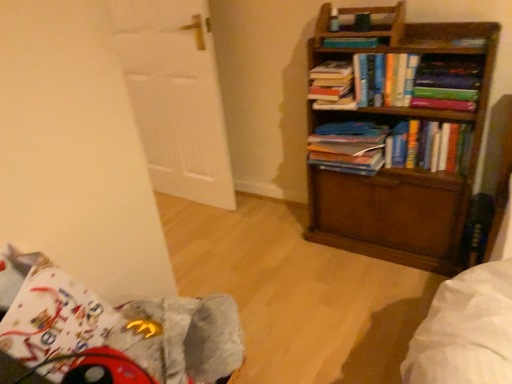
What do you see at coordinates (330, 80) in the screenshot?
I see `hardcover book at upper center, which is the 2th book in top-to-bottom order` at bounding box center [330, 80].

Locate an element on the screen. The width and height of the screenshot is (512, 384). white wooden door at left is located at coordinates (175, 96).

Find the location of a particular element. hardcover book at upper center, the 1th book positioned from the top is located at coordinates (350, 42).

What do you see at coordinates (348, 147) in the screenshot?
I see `blue matte book at center, which is the second book in bottom-to-top order` at bounding box center [348, 147].

Identify the location of hardcover books at upper center, acting as the third book starting from the bottom. (384, 79).

Which object is positioned more to the right, hardcover books at center, arranged as the 5th book when viewed from the top, or hardcover book at upper center, the fifth book positioned from the bottom?

hardcover books at center, arranged as the 5th book when viewed from the top.

Is hardcover books at center, the 1th book from the bottom, oriented away from hardcover book at upper center, the 1th book positioned from the top?

No, hardcover books at center, the 1th book from the bottom, is not facing away from hardcover book at upper center, the 1th book positioned from the top.

Does hardcover books at center, the 1th book from the bottom, have a larger size compared to hardcover book at upper center, the fifth book positioned from the bottom?

Yes, hardcover books at center, the 1th book from the bottom, is bigger than hardcover book at upper center, the fifth book positioned from the bottom.

Is hardcover books at upper center, the 3th book positioned from the top, oriented towards hardcover books at center, the 1th book from the bottom?

No.

Is hardcover books at upper center, acting as the third book starting from the bottom, at the right side of hardcover books at center, the 1th book from the bottom?

No, hardcover books at upper center, acting as the third book starting from the bottom, is not to the right of hardcover books at center, the 1th book from the bottom.

In the scene shown: Does hardcover books at upper center, the 3th book positioned from the top, have a smaller size compared to hardcover books at center, arranged as the 5th book when viewed from the top?

Indeed, hardcover books at upper center, the 3th book positioned from the top, has a smaller size compared to hardcover books at center, arranged as the 5th book when viewed from the top.

Consider the image. Can you confirm if hardcover books at upper center, the 3th book positioned from the top, is taller than hardcover books at center, the 1th book from the bottom?

Incorrect, the height of hardcover books at upper center, the 3th book positioned from the top, is not larger of that of hardcover books at center, the 1th book from the bottom.

Considering the sizes of objects white wooden door at left and fuzzy fabric swivel chair at lower left in the image provided, who is taller, white wooden door at left or fuzzy fabric swivel chair at lower left?

white wooden door at left is taller.

Is point (165, 95) behind point (132, 376)?

Yes, point (165, 95) is farther from viewer.

From a real-world perspective, which object stands above the other?

white wooden door at left.

Is the surface of white wooden door at left in direct contact with fuzzy fabric swivel chair at lower left?

No, white wooden door at left is not beside fuzzy fabric swivel chair at lower left.

Consider the image. Which point is more forward, (126,378) or (366,140)?

The point (126,378) is closer to the camera.

Considering the positions of objects fuzzy fabric swivel chair at lower left and blue matte book at center, the 4th book viewed from the top, in the image provided, who is behind, fuzzy fabric swivel chair at lower left or blue matte book at center, the 4th book viewed from the top,?

blue matte book at center, the 4th book viewed from the top, is more distant.

Is blue matte book at center, the 4th book viewed from the top, surrounded by fuzzy fabric swivel chair at lower left?

No.

Who is smaller, fuzzy fabric swivel chair at lower left or blue matte book at center, the 4th book viewed from the top?

blue matte book at center, the 4th book viewed from the top, is smaller.

Considering the positions of objects hardcover books at center, arranged as the 5th book when viewed from the top, and wooden bookcase at right in the image provided, who is behind, hardcover books at center, arranged as the 5th book when viewed from the top, or wooden bookcase at right?

hardcover books at center, arranged as the 5th book when viewed from the top, is further from the camera.

Does point (444, 126) come closer to viewer compared to point (330, 177)?

That is True.

Does hardcover books at center, arranged as the 5th book when viewed from the top, have a greater width compared to wooden bookcase at right?

Incorrect, the width of hardcover books at center, arranged as the 5th book when viewed from the top, does not surpass that of wooden bookcase at right.

How different are the orientations of hardcover books at center, the 1th book from the bottom, and white wooden door at left in degrees?

There is a 1.13-degree angle between the facing directions of hardcover books at center, the 1th book from the bottom, and white wooden door at left.

Is the surface of hardcover books at center, the 1th book from the bottom, in direct contact with white wooden door at left?

They are not placed beside each other.

Is hardcover books at center, the 1th book from the bottom, inside or outside of white wooden door at left?

hardcover books at center, the 1th book from the bottom, exists outside the volume of white wooden door at left.

Is white wooden door at left not near hardcover book at upper center, which is the 2th book in top-to-bottom order?

No, white wooden door at left is in close proximity to hardcover book at upper center, which is the 2th book in top-to-bottom order.

How different are the orientations of white wooden door at left and hardcover book at upper center, marked as the 4th book in a bottom-to-top arrangement, in degrees?

They differ by 1.98 degrees in their facing directions.

Is white wooden door at left to the left of hardcover book at upper center, marked as the 4th book in a bottom-to-top arrangement, from the viewer's perspective?

Yes, white wooden door at left is to the left of hardcover book at upper center, marked as the 4th book in a bottom-to-top arrangement.

From a real-world perspective, who is located higher, white wooden door at left or hardcover book at upper center, marked as the 4th book in a bottom-to-top arrangement?

hardcover book at upper center, marked as the 4th book in a bottom-to-top arrangement, from a real-world perspective.

Which book is the 3rd one when counting from the left side of the hardcover books at center, the 1th book from the bottom? Please provide its 2D coordinates.

[(350, 42)]

Identify the location of the 2nd book located above the hardcover books at center, arranged as the 5th book when viewed from the top (from a real-world perspective). The image size is (512, 384). (384, 79).

From the image, which object appears to be farther from hardcover books at upper center, acting as the third book starting from the bottom, white wooden door at left or hardcover books at center, arranged as the 5th book when viewed from the top?

white wooden door at left is further to hardcover books at upper center, acting as the third book starting from the bottom.

Looking at the image, which one is located further to hardcover book at upper right, fuzzy fabric swivel chair at lower left or wooden bookcase at right?

fuzzy fabric swivel chair at lower left.

From the image, which object appears to be nearer to hardcover book at upper center, the fifth book positioned from the bottom, white wooden door at left or hardcover books at upper center, the 3th book positioned from the top?

hardcover books at upper center, the 3th book positioned from the top.

When comparing their distances from hardcover books at upper center, the 3th book positioned from the top, does hardcover book at upper center, which is the 2th book in top-to-bottom order, or blue matte book at center, which is the second book in bottom-to-top order, seem further?

blue matte book at center, which is the second book in bottom-to-top order, is further to hardcover books at upper center, the 3th book positioned from the top.

Considering their positions, is hardcover books at center, the 1th book from the bottom, positioned closer to hardcover book at upper center, which is the 2th book in top-to-bottom order, than hardcover books at upper center, acting as the third book starting from the bottom?

hardcover books at upper center, acting as the third book starting from the bottom, lies closer to hardcover book at upper center, which is the 2th book in top-to-bottom order, than the other object.

Which object lies further to the anchor point hardcover books at upper center, the 3th book positioned from the top, hardcover book at upper center, which is the 2th book in top-to-bottom order, or wooden bookcase at right?

wooden bookcase at right is positioned further to the anchor hardcover books at upper center, the 3th book positioned from the top.

Looking at this image, considering their positions, is white wooden door at left positioned further to hardcover book at upper center, marked as the 4th book in a bottom-to-top arrangement, than hardcover books at upper center, acting as the third book starting from the bottom?

white wooden door at left is positioned further to the anchor hardcover book at upper center, marked as the 4th book in a bottom-to-top arrangement.

Estimate the real-world distances between objects in this image. Which object is closer to hardcover book at upper center, marked as the 4th book in a bottom-to-top arrangement, fuzzy fabric swivel chair at lower left or wooden bookcase at right?

wooden bookcase at right is positioned closer to the anchor hardcover book at upper center, marked as the 4th book in a bottom-to-top arrangement.

You are a GUI agent. You are given a task and a screenshot of the screen. Output one action in this format:
    pyautogui.click(x=<x>, y=<y>)
    Task: Click on the bookcase between fuzzy fabric swivel chair at lower left and hardcover book at upper right in the horizontal direction
    This screenshot has height=384, width=512.
    Given the screenshot: What is the action you would take?
    pyautogui.click(x=403, y=138)

The image size is (512, 384). In order to click on bookcase between hardcover book at upper center, the 1th book positioned from the top, and hardcover books at center, arranged as the 5th book when viewed from the top, in the up-down direction in this screenshot , I will do `click(403, 138)`.

In order to click on door between hardcover book at upper center, the fifth book positioned from the bottom, and fuzzy fabric swivel chair at lower left vertically in this screenshot , I will do coord(175,96).

Find the location of `swivel chair between white wooden door at left and hardcover book at upper right in the horizontal direction`. swivel chair between white wooden door at left and hardcover book at upper right in the horizontal direction is located at coordinates (112, 330).